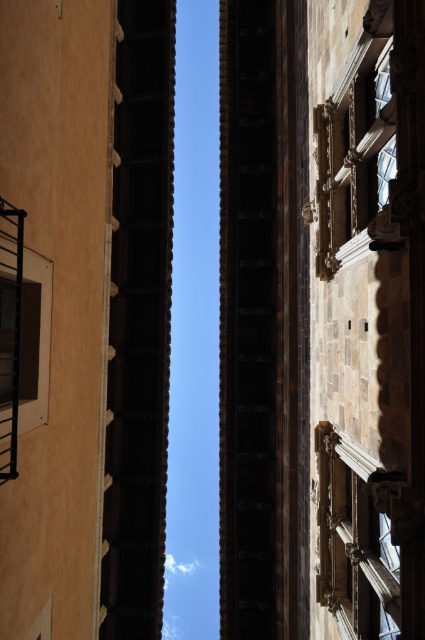
You are a maintenance worker needing to inspect both the polished stone window at lower right and the polished stone window at upper center. Given that your ladder can only reach up to 10 meters, can you safely reach both windows without moving the ladder?

The distance between the polished stone window at lower right and the polished stone window at upper center is 10.34 meters. Since your ladder can only reach up to 10 meters, you cannot safely reach the upper window without moving the ladder.

You are standing in the courtyard of the historic building. You notice a window located at point (357, 538). Is this window positioned to the left or right side of the building?

The window at point (357, 538) is located at the lower right side of the building.